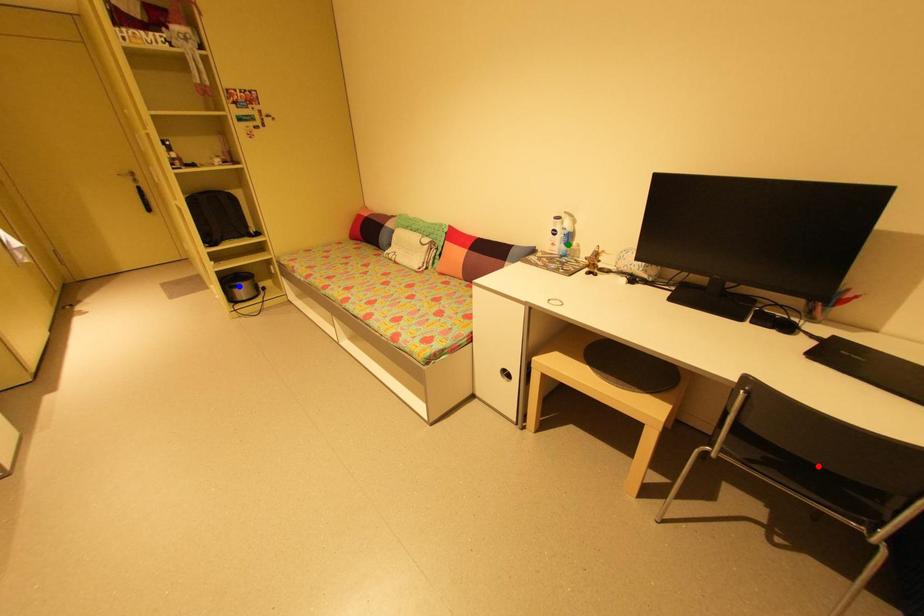
Order these from farthest to nearest:
blue point | red point | green point

blue point
green point
red point